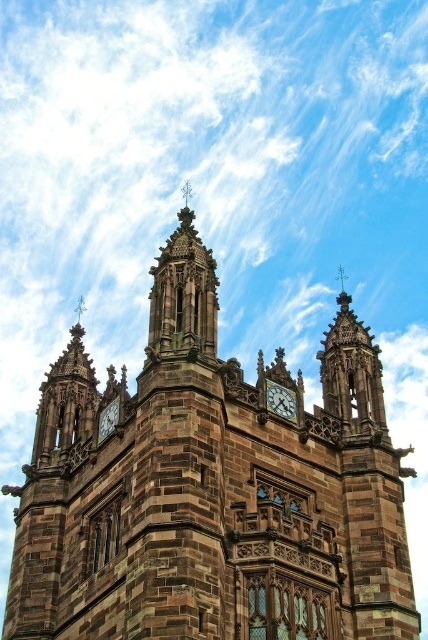
Question: Estimate the real-world distances between objects in this image. Which object is farther from the polished stone clock at center?

Choices:
 (A) matte brown clock at center
 (B) brown stone church at center

Answer: (B)

Question: Which object appears farthest from the camera in this image?

Choices:
 (A) matte brown clock at center
 (B) brown stone church at center
 (C) polished stone clock at center

Answer: (A)

Question: Is polished stone clock at center bigger than matte brown clock at center?

Choices:
 (A) yes
 (B) no

Answer: (A)

Question: Is polished stone clock at center above matte brown clock at center?

Choices:
 (A) yes
 (B) no

Answer: (A)

Question: Does polished stone clock at center appear on the right side of matte brown clock at center?

Choices:
 (A) yes
 (B) no

Answer: (A)

Question: Which of the following is the closest to the observer?

Choices:
 (A) polished stone clock at center
 (B) brown stone church at center
 (C) matte brown clock at center

Answer: (B)